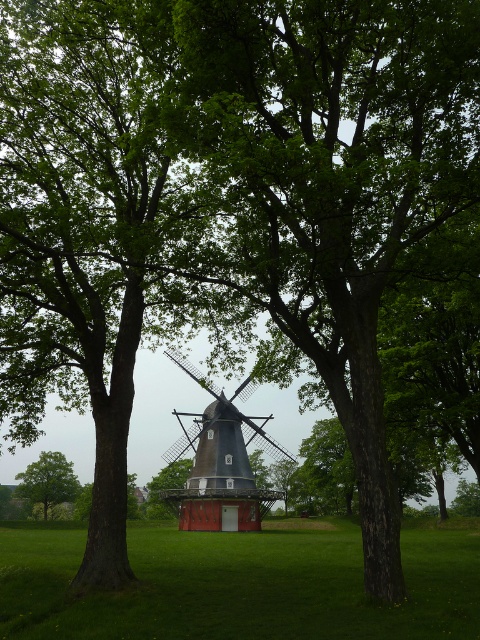
Describe the element at coordinates (240, 586) in the screenshot. I see `green grass at center` at that location.

Who is shorter, green grass at center or green leafy tree at center?

green leafy tree at center is shorter.

Who is more distant from viewer, [189,632] or [45,460]?

Positioned behind is point [45,460].

What are the coordinates of `green grass at center` in the screenshot? It's located at (240, 586).

Is dark brown wooden windmill at center smaller than green leafy tree at center?

Actually, dark brown wooden windmill at center might be larger than green leafy tree at center.

In the scene shown: Is dark brown wooden windmill at center shorter than green leafy tree at center?

In fact, dark brown wooden windmill at center may be taller than green leafy tree at center.

Find the location of `dark brown wooden windmill at center`. dark brown wooden windmill at center is located at coordinates (219, 465).

Is point (283, 616) positioned before point (195, 460)?

That is True.

Locate an element on the screen. The height and width of the screenshot is (640, 480). green grass at center is located at coordinates (240, 586).